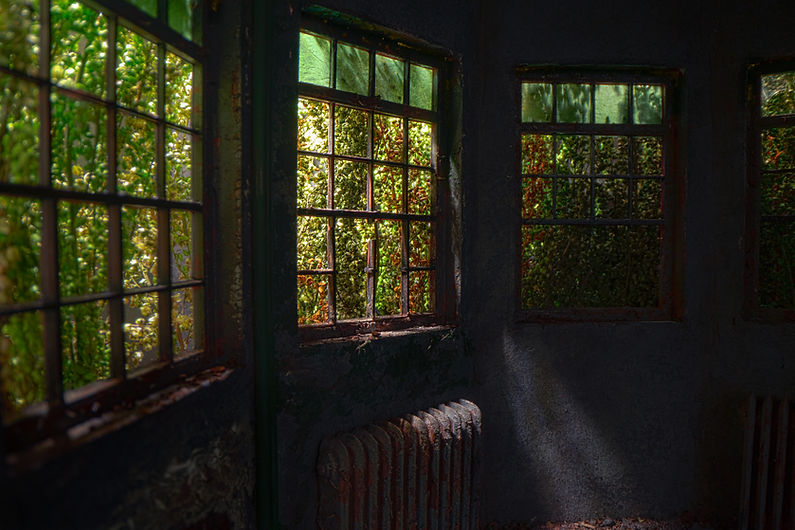
Locate an element on the screen. Image resolution: width=795 pixels, height=530 pixels. radiators is located at coordinates (398, 443), (758, 445).